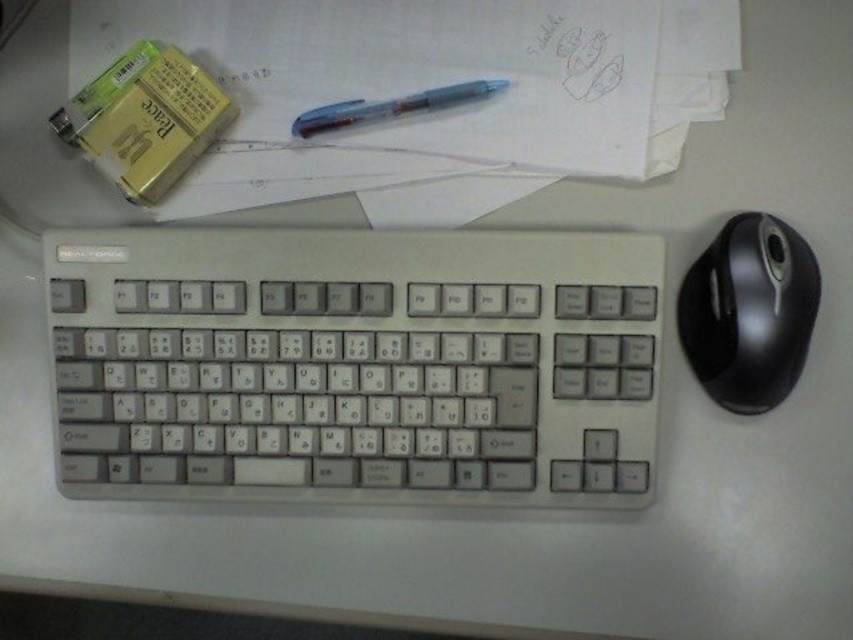
Consider the image. You are a photographer adjusting your camera to capture the workspace scene. There are two points marked in the image at coordinates point (329, 298) and point (120, 13). Which point should you focus on first to ensure it appears sharp in the photo?

Point (329, 298) is closer to the camera than point (120, 13), so you should focus on point (329, 298) first to ensure it appears sharp in the photo.

You are setting up a new desk and need to place the white plastic keyboard at center and the black rubberized mouse at right. If you want to arrange them so that the taller object is on the left side of the desk, which object should you place on the left?

The white plastic keyboard at center is much taller than the black rubberized mouse at right, so you should place the white plastic keyboard at center on the left side of the desk.

You are organizing your desk and need to place a new item between the white plastic keyboard at center and the white paper at upper center. Since the keyboard is to the left of the paper, where should you place the new item to ensure it is between them?

You should place the new item to the right of the white plastic keyboard at center and to the left of the white paper at upper center, as the keyboard is positioned to the left of the paper.